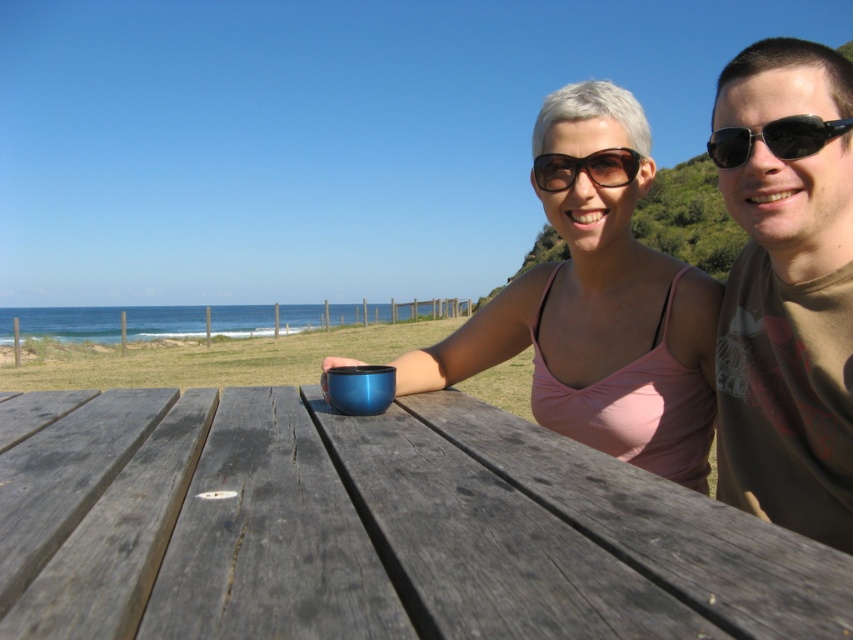
You are a photographer trying to capture a closeup shot of the black plastic sunglasses at upper center and the glossy metallic mug at center. Since your camera can only focus on objects within 25 inches of each other, will you be able to take the photo without moving either object?

The black plastic sunglasses at upper center and glossy metallic mug at center are 27.37 inches apart from each other, which is beyond the camera focus range of 25 inches. Therefore, you will need to move one of the objects closer to the other to take the photo.

You are planning to place a decorative item on the picnic table. You have a small figurine that is 5 cm in height. The black plastic sunglasses at upper center and the glossy metallic mug at center are already on the table. Which object would be more stable to place the figurine on?

The black plastic sunglasses at upper center is larger in size than the glossy metallic mug at center, so placing the figurine on the black plastic sunglasses at upper center would provide a more stable base due to its larger surface area.